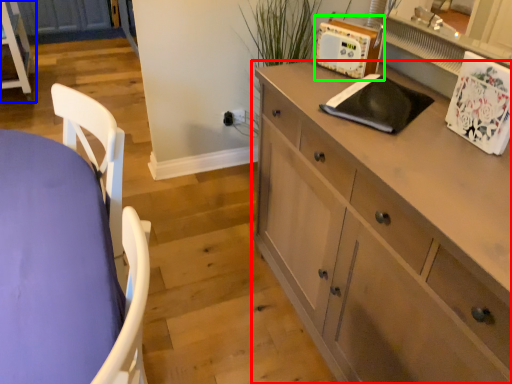
Question: Which object is positioned farthest from cabinetry (highlighted by a red box)? Select from chest of drawers (highlighted by a blue box) and appliance (highlighted by a green box).

Choices:
 (A) chest of drawers
 (B) appliance

Answer: (A)